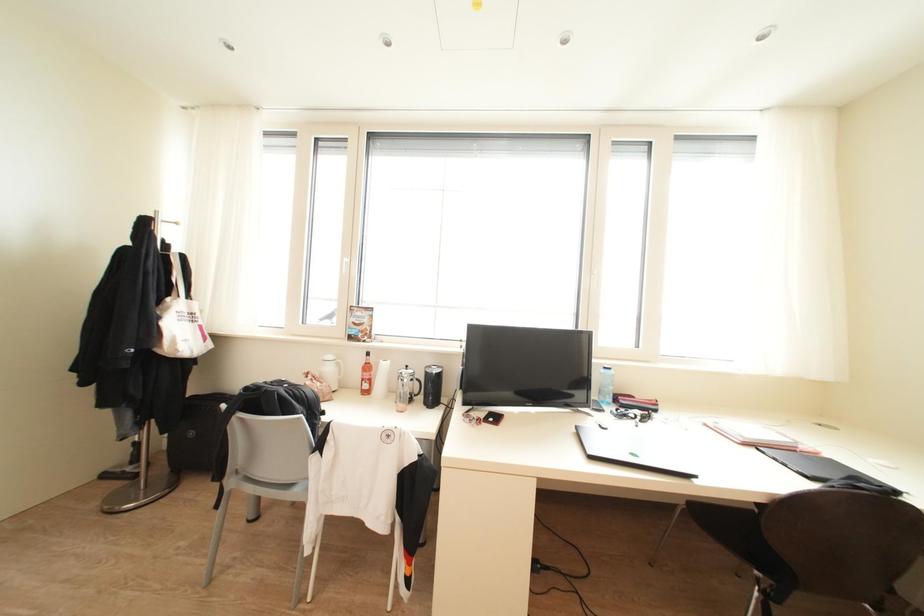
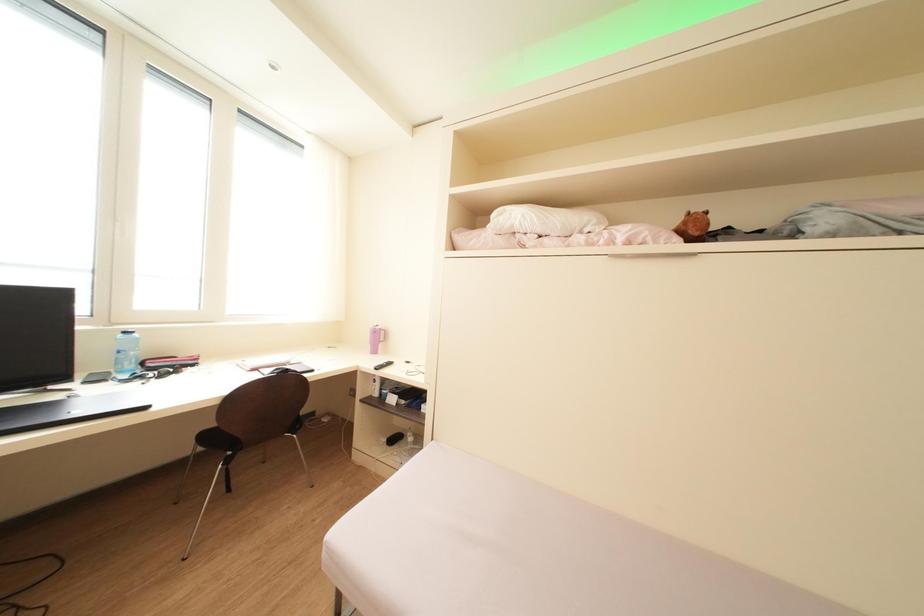
Question: The camera is either moving clockwise (left) or counter-clockwise (right) around the object. The first image is from the beginning of the video and the second image is from the end. Is the camera moving left or right when shooting the video?

Choices:
 (A) Left
 (B) Right

Answer: (A)